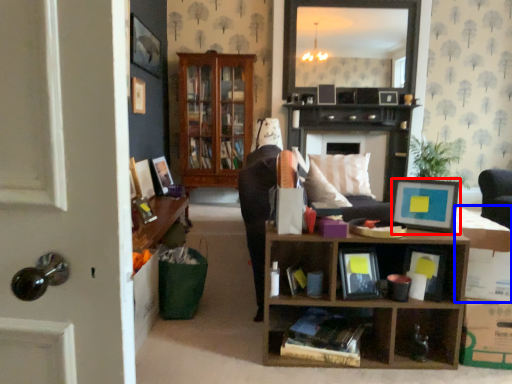
Question: Among these objects, which one is farthest to the camera, picture frame (highlighted by a red box) or cardboard box (highlighted by a blue box)?

Choices:
 (A) picture frame
 (B) cardboard box

Answer: (A)